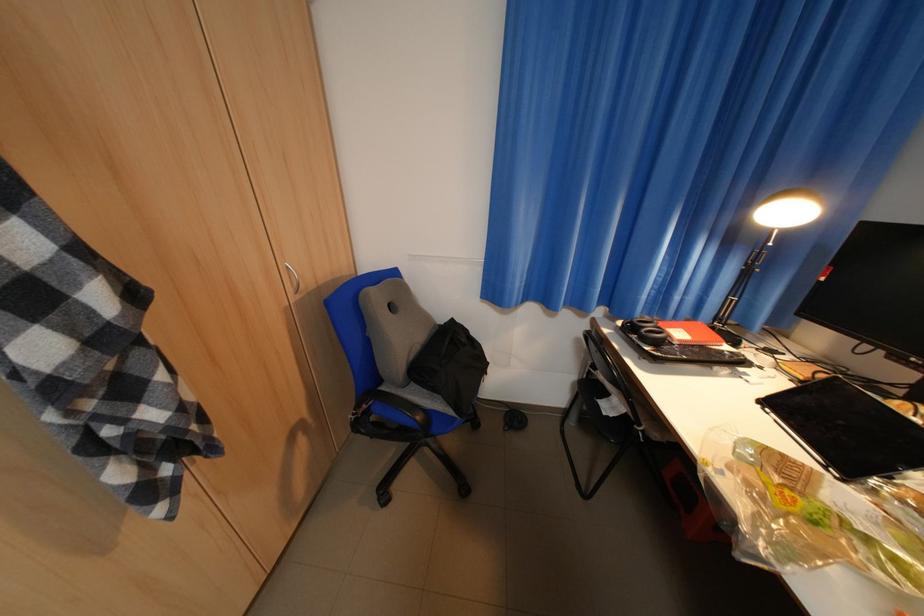
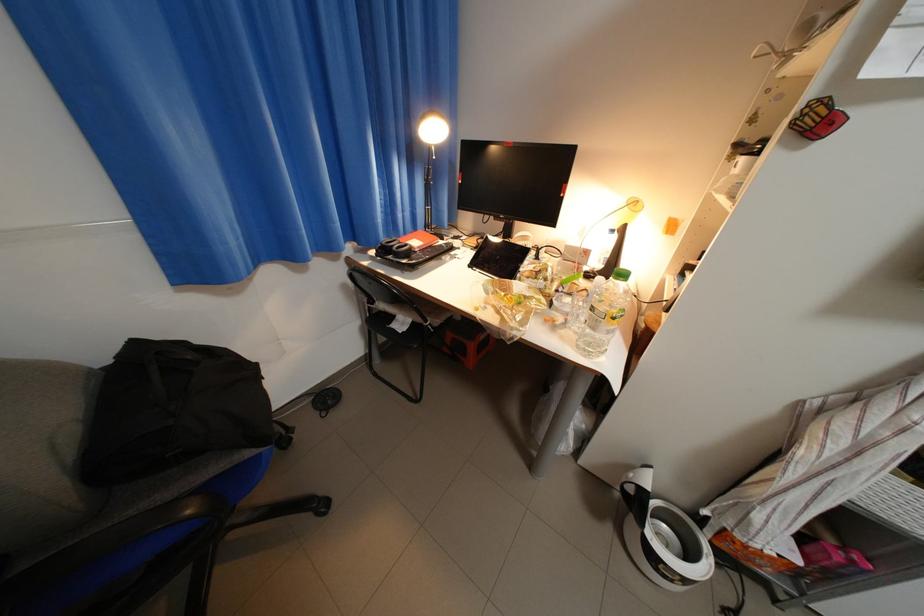
In the second image, find the point that corresponds to pixel 589 341 in the first image.

(355, 286)